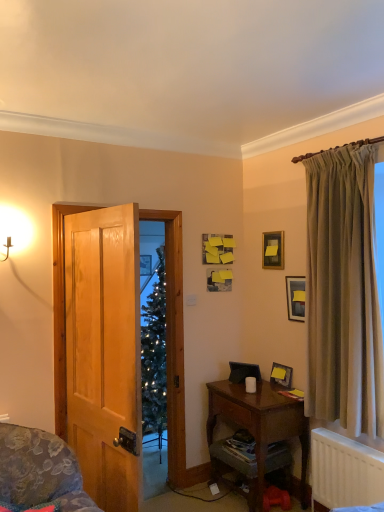
What do you see at coordinates (13, 231) in the screenshot?
I see `matte gold sconce at upper left` at bounding box center [13, 231].

What do you see at coordinates (343, 292) in the screenshot? The width and height of the screenshot is (384, 512). I see `silky beige curtain at right` at bounding box center [343, 292].

What is the approximate height of wooden cabinet at lower right?

The height of wooden cabinet at lower right is 14.20 inches.

The image size is (384, 512). Describe the element at coordinates (234, 470) in the screenshot. I see `wooden cabinet at lower right` at that location.

The image size is (384, 512). In order to click on wooden door at left in this screenshot , I will do `click(174, 340)`.

Find the location of a particular element. The height and width of the screenshot is (512, 384). door beneath the wooden picture frame at upper center, which is counted as the 1th picture frame, starting from the top (from a real-world perspective) is located at coordinates (174, 340).

Between wooden picture frame at upper center, which is counted as the 1th picture frame, starting from the top, and wooden door at left, which one has smaller width?

wooden picture frame at upper center, which is counted as the 1th picture frame, starting from the top, is thinner.

Is wooden picture frame at upper center, which is counted as the 1th picture frame, starting from the top, taller or shorter than wooden door at left?

In the image, wooden picture frame at upper center, which is counted as the 1th picture frame, starting from the top, appears to be shorter than wooden door at left.

Considering the points (288, 384) and (278, 394), which point is in front, point (288, 384) or point (278, 394)?

The point (278, 394) is closer.

Which of these two, matte black picture frame at lower right, which appears as the 1th picture frame when ordered from the bottom, or wooden desk at lower right, is smaller?

matte black picture frame at lower right, which appears as the 1th picture frame when ordered from the bottom, is smaller.

The width and height of the screenshot is (384, 512). I want to click on desk below the matte black picture frame at lower right, which appears as the 1th picture frame when ordered from the bottom (from a real-world perspective), so click(x=261, y=422).

Are matte black picture frame at lower right, which appears as the 3th picture frame when viewed from the top, and wooden desk at lower right far apart?

They are positioned close to each other.

Considering the relative sizes of matte gold sconce at upper left and white matte coffee cup at lower center in the image provided, is matte gold sconce at upper left thinner than white matte coffee cup at lower center?

No, matte gold sconce at upper left is not thinner than white matte coffee cup at lower center.

Measure the distance from matte gold sconce at upper left to white matte coffee cup at lower center.

matte gold sconce at upper left is 1.92 meters from white matte coffee cup at lower center.

In the image, is matte gold sconce at upper left positioned in front of or behind white matte coffee cup at lower center?

matte gold sconce at upper left is in front of white matte coffee cup at lower center.

Can you tell me how much matte gold sconce at upper left and white matte coffee cup at lower center differ in facing direction?

They differ by 86.9 degrees in their facing directions.

In the image, is white matte coffee cup at lower center on the left side or the right side of matte black picture frame at lower right, which appears as the 3th picture frame when viewed from the top?

Clearly, white matte coffee cup at lower center is on the left of matte black picture frame at lower right, which appears as the 3th picture frame when viewed from the top, in the image.

Is white matte coffee cup at lower center smaller than matte black picture frame at lower right, which appears as the 1th picture frame when ordered from the bottom?

Yes, white matte coffee cup at lower center is smaller than matte black picture frame at lower right, which appears as the 1th picture frame when ordered from the bottom.

This screenshot has width=384, height=512. I want to click on picture frame that is the 3rd one when counting rightward from the matte gold sconce at upper left, so [296, 297].

Is matte gold sconce at upper left taller than matte black picture frame at upper center, which is the 2th picture frame from bottom to top?

In fact, matte gold sconce at upper left may be shorter than matte black picture frame at upper center, which is the 2th picture frame from bottom to top.

Which is more to the right, matte gold sconce at upper left or matte black picture frame at upper center, which is the 2th picture frame from bottom to top?

matte black picture frame at upper center, which is the 2th picture frame from bottom to top, is more to the right.

Is matte gold sconce at upper left facing towards matte black picture frame at upper center, placed as the second picture frame when sorted from top to bottom?

No.

Between wooden picture frame at upper center, which is counted as the 1th picture frame, starting from the top, and wooden cabinet at lower right, which one appears on the right side from the viewer's perspective?

From the viewer's perspective, wooden picture frame at upper center, which is counted as the 1th picture frame, starting from the top, appears more on the right side.

How many degrees apart are the facing directions of wooden picture frame at upper center, placed as the third picture frame when sorted from bottom to top, and wooden cabinet at lower right?

They differ by 3.6 degrees in their facing directions.

You are a GUI agent. You are given a task and a screenshot of the screen. Output one action in this format:
    pyautogui.click(x=<x>, y=<y>)
    Task: Click on the cabinetry below the wooden picture frame at upper center, which is counted as the 1th picture frame, starting from the top (from a real-world perspective)
    Image resolution: width=384 pixels, height=512 pixels.
    Given the screenshot: What is the action you would take?
    pyautogui.click(x=234, y=470)

Looking at the image, does wooden picture frame at upper center, which is counted as the 1th picture frame, starting from the top, seem bigger or smaller compared to wooden cabinet at lower right?

wooden picture frame at upper center, which is counted as the 1th picture frame, starting from the top, is smaller than wooden cabinet at lower right.

Is silky beige curtain at right wider or thinner than matte gold sconce at upper left?

silky beige curtain at right is wider than matte gold sconce at upper left.

Find the location of `light fixture lying above the silky beige curtain at right (from the image's perspective)`. light fixture lying above the silky beige curtain at right (from the image's perspective) is located at coordinates (x=13, y=231).

Is point (330, 376) positioned after point (16, 228)?

Yes, it is behind point (16, 228).

In the scene shown: From the image's perspective, between silky beige curtain at right and matte gold sconce at upper left, which one is located above?

matte gold sconce at upper left is shown above in the image.

What are the coordinates of `the 3rd picture frame behind the wooden door at left, starting your count from the anchor` in the screenshot? It's located at (273, 250).

At what (x,y) coordinates should I click in order to perform the action: click on desk below the matte black picture frame at lower right, which appears as the 1th picture frame when ordered from the bottom (from a real-world perspective). Please return your answer as a coordinate pair (x, y). Looking at the image, I should click on (261, 422).

When comparing their distances from silky beige curtain at right, does matte black picture frame at upper center, which is the 2th picture frame from bottom to top, or matte black picture frame at lower right, which appears as the 1th picture frame when ordered from the bottom, seem closer?

matte black picture frame at upper center, which is the 2th picture frame from bottom to top.

Which object lies further to the anchor point wooden cabinet at lower right, wooden door at left or wooden desk at lower right?

wooden door at left is further to wooden cabinet at lower right.

When comparing their distances from wooden picture frame at upper center, which is counted as the 1th picture frame, starting from the top, does wooden cabinet at lower right or matte black picture frame at upper center, placed as the second picture frame when sorted from top to bottom, seem further?

The object further to wooden picture frame at upper center, which is counted as the 1th picture frame, starting from the top, is wooden cabinet at lower right.

Which object lies further to the anchor point matte black picture frame at lower right, which appears as the 3th picture frame when viewed from the top, white matte coffee cup at lower center or wooden desk at lower right?

wooden desk at lower right lies further to matte black picture frame at lower right, which appears as the 3th picture frame when viewed from the top, than the other object.

Estimate the real-world distances between objects in this image. Which object is closer to white plastic radiator at lower right, wooden door at left or wooden picture frame at upper center, which is counted as the 1th picture frame, starting from the top?

Based on the image, wooden door at left appears to be nearer to white plastic radiator at lower right.

Looking at the image, which one is located further to wooden picture frame at upper center, which is counted as the 1th picture frame, starting from the top, matte gold sconce at upper left or matte black picture frame at lower right, which appears as the 3th picture frame when viewed from the top?

matte gold sconce at upper left lies further to wooden picture frame at upper center, which is counted as the 1th picture frame, starting from the top, than the other object.

Considering their positions, is matte black picture frame at upper center, placed as the second picture frame when sorted from top to bottom, positioned closer to matte gold sconce at upper left than matte black picture frame at lower right, which appears as the 3th picture frame when viewed from the top?

The object closer to matte gold sconce at upper left is matte black picture frame at upper center, placed as the second picture frame when sorted from top to bottom.

Looking at the image, which one is located further to white matte coffee cup at lower center, matte black picture frame at lower right, which appears as the 3th picture frame when viewed from the top, or wooden door at left?

wooden door at left is positioned further to the anchor white matte coffee cup at lower center.

This screenshot has height=512, width=384. I want to click on coffee cup situated between matte gold sconce at upper left and matte black picture frame at lower right, which appears as the 1th picture frame when ordered from the bottom, from left to right, so pyautogui.click(x=250, y=384).

The width and height of the screenshot is (384, 512). I want to click on coffee cup between white plastic radiator at lower right and matte black picture frame at lower right, which appears as the 1th picture frame when ordered from the bottom, along the z-axis, so click(250, 384).

Where is `picture frame between matte black picture frame at upper center, placed as the second picture frame when sorted from top to bottom, and wooden cabinet at lower right, in the vertical direction`? picture frame between matte black picture frame at upper center, placed as the second picture frame when sorted from top to bottom, and wooden cabinet at lower right, in the vertical direction is located at coordinates (281, 375).

The height and width of the screenshot is (512, 384). What are the coordinates of `desk situated between wooden door at left and matte black picture frame at lower right, which appears as the 1th picture frame when ordered from the bottom, from left to right` in the screenshot? It's located at (261, 422).